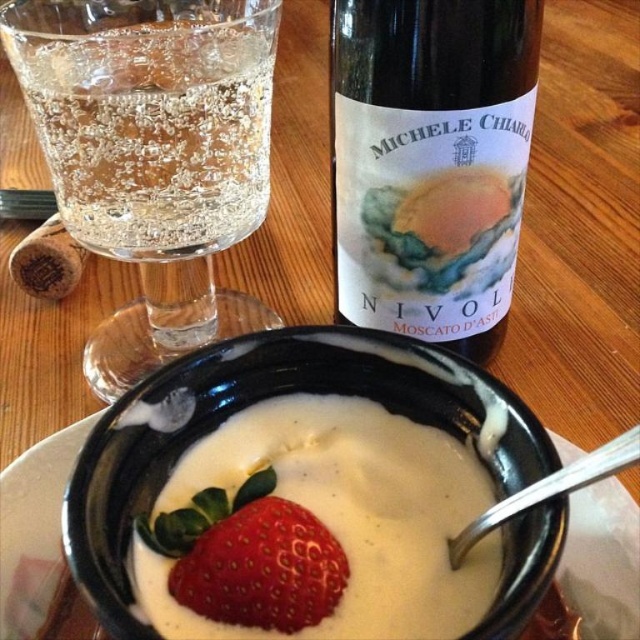
Between matte black bowl at center and shiny red strawberry at center, which one is positioned lower?

Positioned lower is shiny red strawberry at center.

Can you confirm if matte black bowl at center is wider than shiny red strawberry at center?

Yes.

Locate an element on the screen. This screenshot has height=640, width=640. matte black bowl at center is located at coordinates (262, 400).

Which is behind, point (177, 253) or point (260, 545)?

Positioned behind is point (177, 253).

Is point (208, 225) closer to viewer compared to point (164, 540)?

No, (208, 225) is further to viewer.

Identify the location of clear glass wine glass at upper left. The width and height of the screenshot is (640, 640). (152, 154).

Can you confirm if dark brown glass bottle at upper right is positioned above shiny red strawberry at center?

Yes.

The width and height of the screenshot is (640, 640). In order to click on dark brown glass bottle at upper right in this screenshot , I will do `click(429, 163)`.